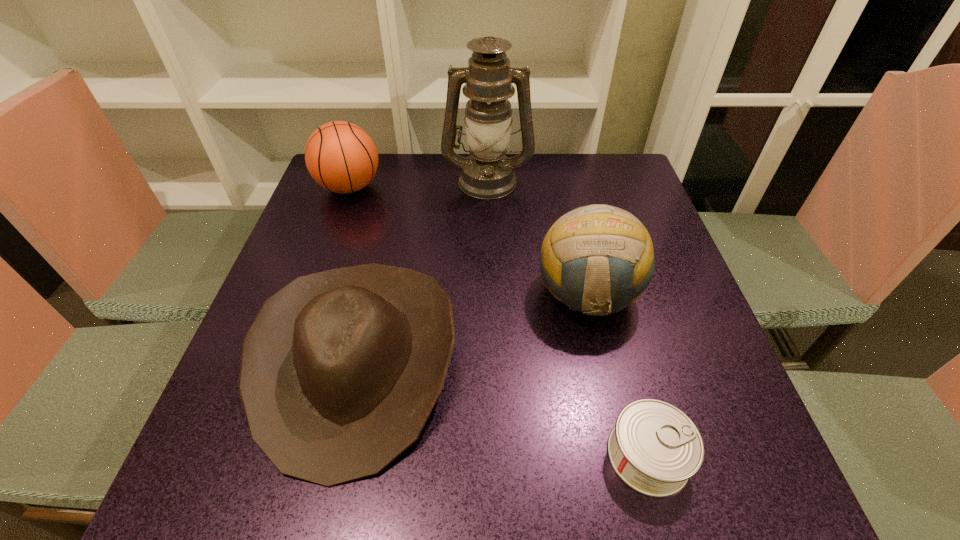
Locate an element on the screen. The width and height of the screenshot is (960, 540). object positioned at the near right corner is located at coordinates (654, 447).

What are the coordinates of `free spot at the far edge of the desktop` in the screenshot? It's located at (583, 198).

You are a GUI agent. You are given a task and a screenshot of the screen. Output one action in this format:
    pyautogui.click(x=<x>, y=<y>)
    Task: Click on the blank space at the near edge of the desktop
    The height and width of the screenshot is (540, 960).
    Given the screenshot: What is the action you would take?
    pyautogui.click(x=521, y=508)

Where is `vacant space at the left edge of the desktop`? vacant space at the left edge of the desktop is located at coordinates (359, 242).

Identify the location of vacant point at the right edge. (682, 309).

Identify the location of vacant space at the near left corner of the desktop. The image size is (960, 540). (180, 495).

Locate an element on the screen. The image size is (960, 540). vacant space at the far right corner of the desktop is located at coordinates (596, 174).

The image size is (960, 540). I want to click on empty space between the basketball and the volleyball, so click(x=468, y=241).

At what (x,y) coordinates should I click in order to perform the action: click on free spot between the volleyball and the can. Please return your answer as a coordinate pair (x, y). Looking at the image, I should click on (618, 375).

In order to click on free area in between the basketball and the shortest object in this screenshot , I will do `click(499, 321)`.